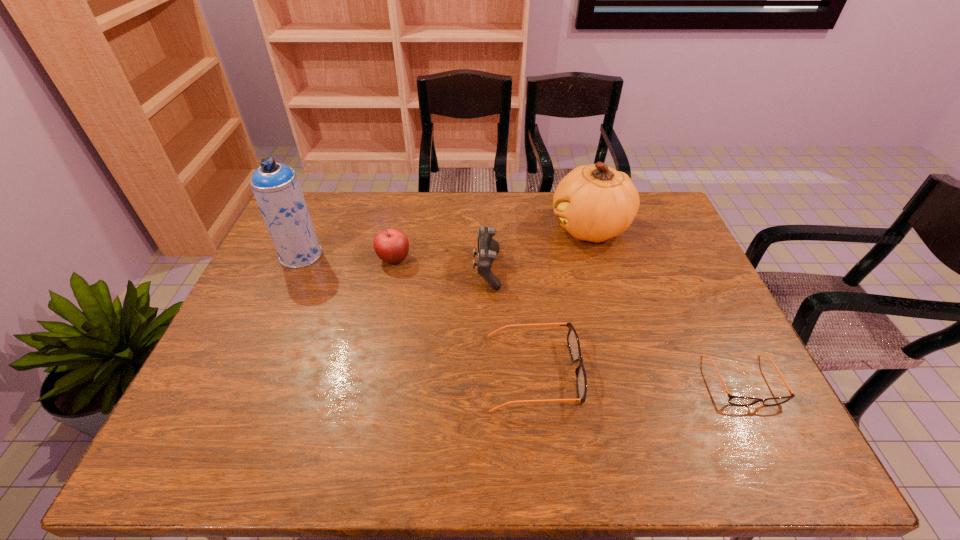
The image size is (960, 540). What are the coordinates of `spectacles present at the right edge` in the screenshot? It's located at point(734,400).

The image size is (960, 540). I want to click on pumpkin that is at the right edge, so click(595, 202).

Find the location of a particular element. The height and width of the screenshot is (540, 960). object present at the far right corner is located at coordinates (595, 202).

Find the location of `object present at the near right corner`. object present at the near right corner is located at coordinates (734, 400).

I want to click on free region at the far edge, so click(x=352, y=227).

Where is `free space at the near edge of the desktop`? The height and width of the screenshot is (540, 960). free space at the near edge of the desktop is located at coordinates (660, 394).

Locate an element on the screen. The height and width of the screenshot is (540, 960). free location at the left edge of the desktop is located at coordinates (278, 273).

Where is `blank space at the right edge of the desktop`? Image resolution: width=960 pixels, height=540 pixels. blank space at the right edge of the desktop is located at coordinates (652, 247).

Find the location of a particular element. Image resolution: width=960 pixels, height=540 pixels. free space at the far left corner is located at coordinates coord(311,208).

Locate an element on the screen. This screenshot has height=540, width=960. vacant space at the far right corner is located at coordinates (675, 231).